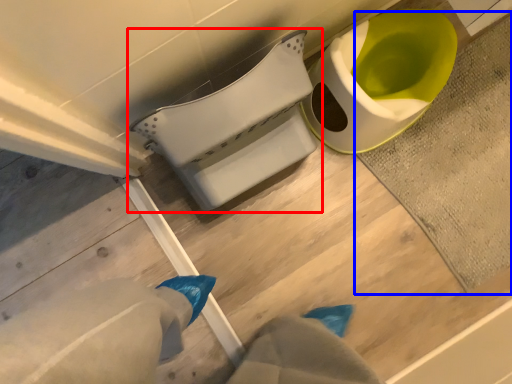
Question: Which of the following is the farthest to the observer, toilet (highlighted by a red box) or bath mat (highlighted by a blue box)?

Choices:
 (A) toilet
 (B) bath mat

Answer: (B)